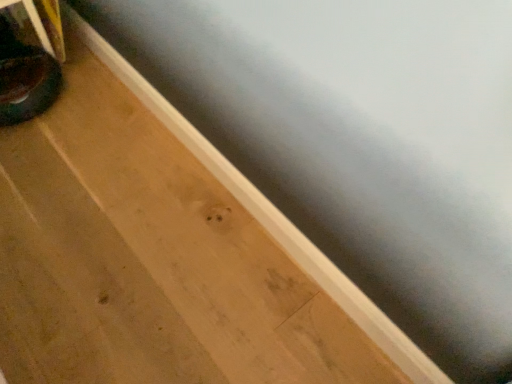
The image size is (512, 384). What are the coordinates of `vacant point to the right of shiny brown shoe at left` in the screenshot? It's located at (94, 105).